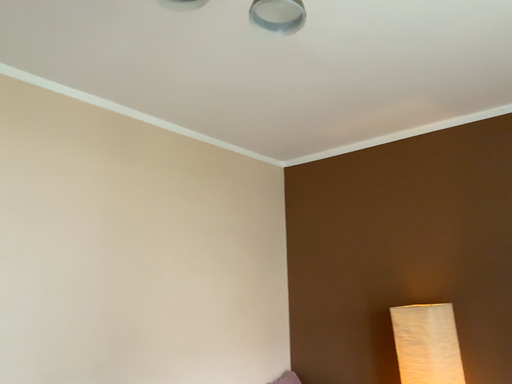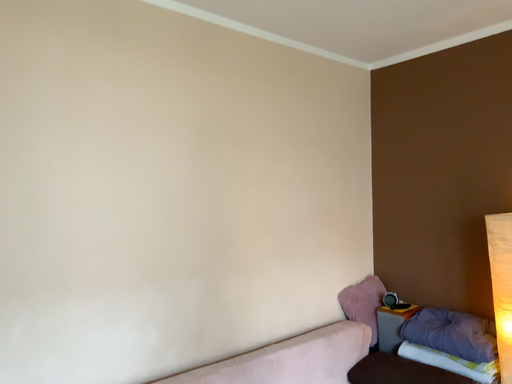
Question: How did the camera likely rotate when shooting the video?

Choices:
 (A) rotated downward
 (B) rotated upward

Answer: (A)